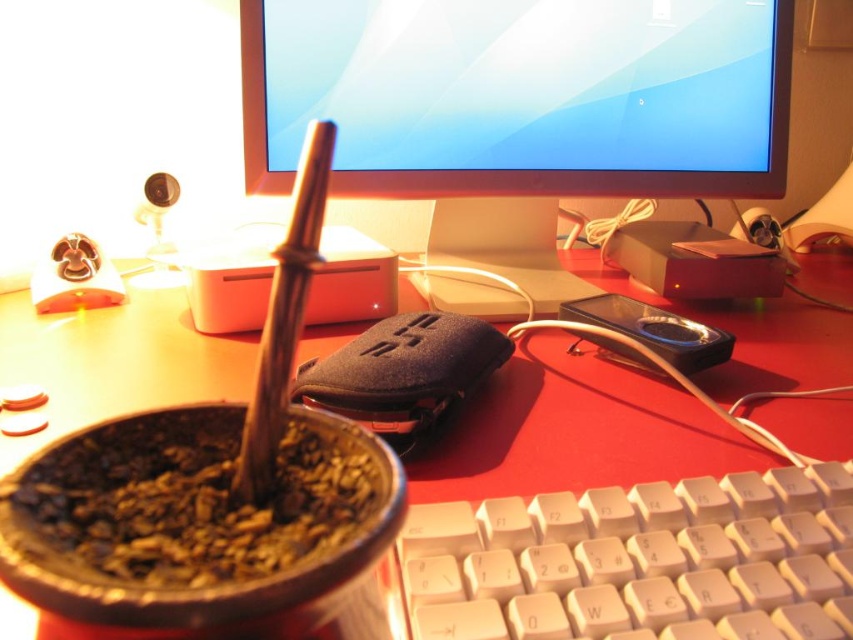
You are sitting at this workspace and want to reach for the matte black monitor at upper center and the white plastic keyboard at lower center. Which object is closer to you?

The matte black monitor at upper center is closer to you because it is further to the viewer than the white plastic keyboard at lower center, meaning it appears nearer in the scene.

You are organizing your desk and want to place both the white plastic keyboard at lower center and the brown matte mate at center. Since space is limited, which object should you prioritize keeping if you need to remove the smaller one?

The brown matte mate at center is smaller than the white plastic keyboard at lower center, so you should prioritize keeping the white plastic keyboard at lower center and remove the brown matte mate at center.

You are sitting at a desk and want to reach the white plastic keyboard at lower center without moving your chair. Can you comfortably reach it if your arm can extend 12 inches?

The white plastic keyboard at lower center is 10.86 inches away from the viewer, so yes, you can comfortably reach it since your arm can extend 12 inches, which is longer than the distance to the keyboard.